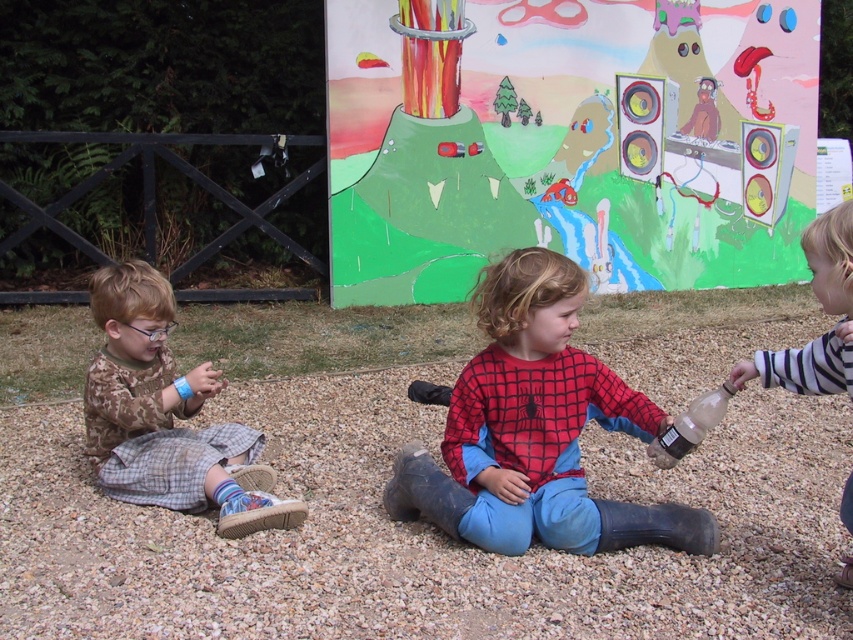
You are standing at the point labeled point (422,531). Looking around, you see three children sitting on the gravel. Which direction should you move to reach the child on the right?

The point (422,531) is located on the gray gravel at center. To reach the child on the right, you should move to the right from the central point.

You are a parent trying to ensure your children are safe while playing on the gray gravel at center. The children are spread out. What is the minimum distance you need to move between the farthest two children?

The minimum distance you need to move between the farthest two children is 2.67 meters.